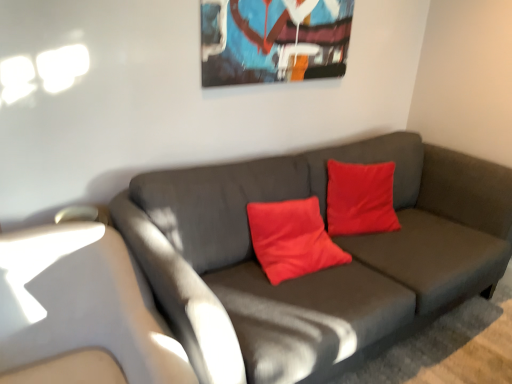
You are a GUI agent. You are given a task and a screenshot of the screen. Output one action in this format:
    pyautogui.click(x=<x>, y=<y>)
    Task: Click on the metallic glossy picture frame at upper center
    This screenshot has width=512, height=384.
    Given the screenshot: What is the action you would take?
    pyautogui.click(x=273, y=40)

In order to face metallic glossy picture frame at upper center, should I rotate leftwards or rightwards?

To face it directly, rotate right by 4.052 degrees.

Image resolution: width=512 pixels, height=384 pixels. Describe the element at coordinates (273, 40) in the screenshot. I see `metallic glossy picture frame at upper center` at that location.

Describe the element at coordinates (321, 270) in the screenshot. I see `matte gray couch at center` at that location.

The width and height of the screenshot is (512, 384). I want to click on matte gray couch at center, so click(x=321, y=270).

Measure the distance between point (314, 285) and camera.

Point (314, 285) is 5.74 feet away from camera.

This screenshot has height=384, width=512. What are the coordinates of `metallic glossy picture frame at upper center` in the screenshot? It's located at (273, 40).

Which is more to the left, matte gray couch at center or metallic glossy picture frame at upper center?

metallic glossy picture frame at upper center.

Relative to metallic glossy picture frame at upper center, is matte gray couch at center in front or behind?

matte gray couch at center is in front of metallic glossy picture frame at upper center.

Considering the positions of point (174, 173) and point (236, 5), is point (174, 173) closer or farther from the camera than point (236, 5)?

Point (174, 173) is closer to the camera than point (236, 5).

From the image's perspective, is matte gray couch at center above or below metallic glossy picture frame at upper center?

Based on their image positions, matte gray couch at center is located beneath metallic glossy picture frame at upper center.

Looking at this image, from a real-world perspective, who is located higher, matte gray couch at center or metallic glossy picture frame at upper center?

In real-world perspective, metallic glossy picture frame at upper center is above.

Which of these two, matte gray couch at center or metallic glossy picture frame at upper center, is wider?

matte gray couch at center is wider.

Considering the sizes of objects matte gray couch at center and metallic glossy picture frame at upper center in the image provided, who is taller, matte gray couch at center or metallic glossy picture frame at upper center?

Standing taller between the two is matte gray couch at center.

Between matte gray couch at center and metallic glossy picture frame at upper center, which one has larger size?

Bigger between the two is matte gray couch at center.

Is matte gray couch at center inside or outside of metallic glossy picture frame at upper center?

matte gray couch at center is outside metallic glossy picture frame at upper center.

Are matte gray couch at center and metallic glossy picture frame at upper center making contact?

No.

In the scene shown: Is matte gray couch at center oriented away from metallic glossy picture frame at upper center?

No, matte gray couch at center is not facing the opposite direction of metallic glossy picture frame at upper center.

How different are the orientations of matte gray couch at center and metallic glossy picture frame at upper center in degrees?

The facing directions of matte gray couch at center and metallic glossy picture frame at upper center are 0.286 degrees apart.

How distant is matte gray couch at center from metallic glossy picture frame at upper center?

A distance of 29.93 inches exists between matte gray couch at center and metallic glossy picture frame at upper center.

In order to click on studio couch lying on the right of metallic glossy picture frame at upper center in this screenshot , I will do `click(321, 270)`.

Is metallic glossy picture frame at upper center at the right side of matte gray couch at center?

In fact, metallic glossy picture frame at upper center is to the left of matte gray couch at center.

Is metallic glossy picture frame at upper center positioned in front of matte gray couch at center?

That is False.

Considering the positions of points (324, 20) and (462, 237), is point (324, 20) farther from camera compared to point (462, 237)?

Yes, point (324, 20) is farther from viewer.

From the image's perspective, between metallic glossy picture frame at upper center and matte gray couch at center, which one is located above?

metallic glossy picture frame at upper center, from the image's perspective.

From a real-world perspective, is metallic glossy picture frame at upper center on top of matte gray couch at center?

Yes, from a real-world perspective, metallic glossy picture frame at upper center is on top of matte gray couch at center.

Does metallic glossy picture frame at upper center have a greater width compared to matte gray couch at center?

No, metallic glossy picture frame at upper center is not wider than matte gray couch at center.

Considering the relative sizes of metallic glossy picture frame at upper center and matte gray couch at center in the image provided, is metallic glossy picture frame at upper center shorter than matte gray couch at center?

Correct, metallic glossy picture frame at upper center is not as tall as matte gray couch at center.

Considering the sizes of metallic glossy picture frame at upper center and matte gray couch at center in the image, is metallic glossy picture frame at upper center bigger or smaller than matte gray couch at center?

Clearly, metallic glossy picture frame at upper center is smaller in size than matte gray couch at center.

Is matte gray couch at center inside metallic glossy picture frame at upper center?

Definitely not — matte gray couch at center is not inside metallic glossy picture frame at upper center.

Is metallic glossy picture frame at upper center placed right next to matte gray couch at center?

No, metallic glossy picture frame at upper center is not with matte gray couch at center.

Is metallic glossy picture frame at upper center oriented away from matte gray couch at center?

No, metallic glossy picture frame at upper center is not facing away from matte gray couch at center.

How different are the orientations of metallic glossy picture frame at upper center and matte gray couch at center in degrees?

There is a 0.286-degree angle between the facing directions of metallic glossy picture frame at upper center and matte gray couch at center.

Locate an element on the screen. The width and height of the screenshot is (512, 384). picture frame on the left of matte gray couch at center is located at coordinates (273, 40).

Locate an element on the screen. studio couch lying on the right of metallic glossy picture frame at upper center is located at coordinates (321, 270).

Locate an element on the screen. The width and height of the screenshot is (512, 384). picture frame behind the matte gray couch at center is located at coordinates (273, 40).